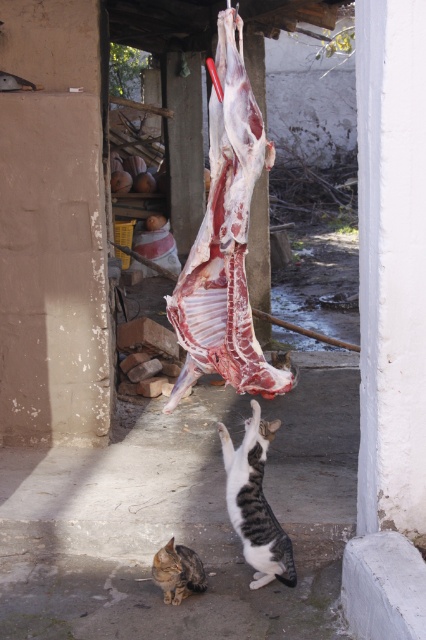
Can you confirm if tabby fur cat at center is smaller than tabby fur cat at lower center?

Actually, tabby fur cat at center might be larger than tabby fur cat at lower center.

Is tabby fur cat at center positioned behind tabby fur cat at lower center?

No, it is not.

Is point (227, 512) farther from viewer compared to point (167, 563)?

Yes, point (227, 512) is behind point (167, 563).

Identify the location of tabby fur cat at center. (255, 502).